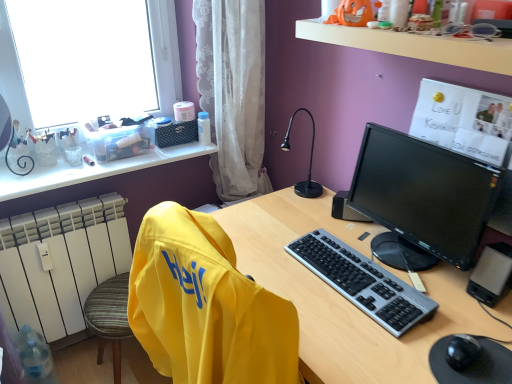
This screenshot has height=384, width=512. I want to click on free space to the left of black rubber mouse at lower right, so click(392, 343).